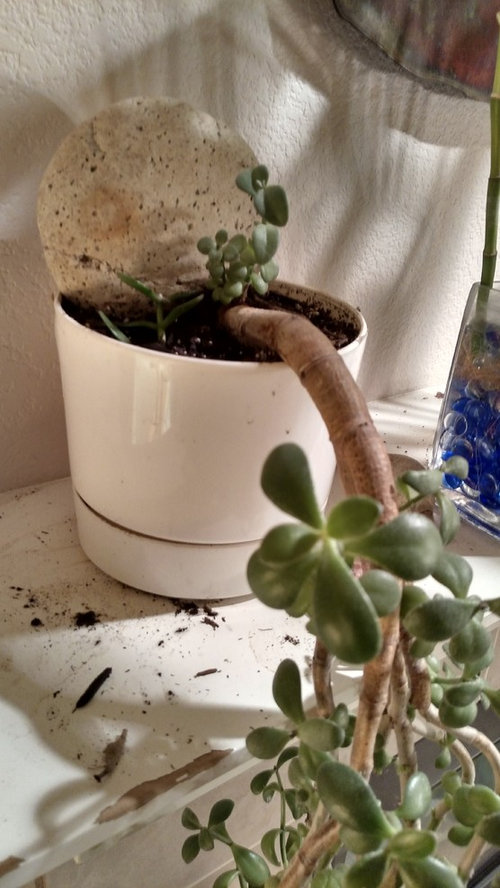
You are a GUI agent. You are given a task and a screenshot of the screen. Output one action in this format:
    pyautogui.click(x=<x>, y=<y>)
    Task: Click on the white surface
    
    Given the screenshot: What is the action you would take?
    pyautogui.click(x=227, y=730)